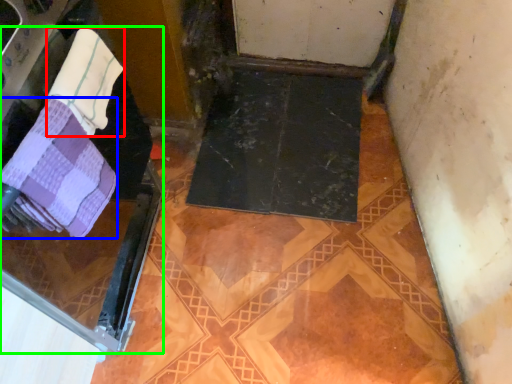
Question: Which is nearer to the towel (highlighted by a red box)? towel (highlighted by a blue box) or screen door (highlighted by a green box).

Choices:
 (A) towel
 (B) screen door

Answer: (A)